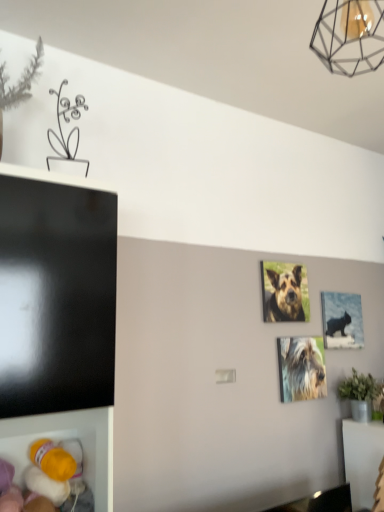
In order to face metallic wireframe lamp at upper right, should I rotate leftwards or rightwards?

Rotate right and turn 20.564 degrees.

Measure the distance between metallic wireframe lamp at upper right and camera.

A distance of 35.16 inches exists between metallic wireframe lamp at upper right and camera.

I want to click on shaggy fur dog at center, the second dog in the top-to-bottom sequence, so click(x=302, y=368).

Based on their positions, is metallic silver picture frame at center-right located to the left or right of brown fur dog at center, positioned as the first dog in top-to-bottom order?

In the image, metallic silver picture frame at center-right appears on the right side of brown fur dog at center, positioned as the first dog in top-to-bottom order.

Where is `picture frame lying below the brown fur dog at center, positioned as the first dog in top-to-bottom order (from the image's perspective)`? This screenshot has height=512, width=384. picture frame lying below the brown fur dog at center, positioned as the first dog in top-to-bottom order (from the image's perspective) is located at coordinates (x=342, y=320).

Considering the points (343, 323) and (287, 311), which point is in front, point (343, 323) or point (287, 311)?

Positioned in front is point (287, 311).

From a real-world perspective, is metallic silver picture frame at center-right under brown fur dog at center, marked as the 2th dog in a bottom-to-top arrangement?

Yes.

Can you confirm if metallic silver picture frame at center-right is taller than shaggy fur dog at center, the second dog in the top-to-bottom sequence?

Indeed, metallic silver picture frame at center-right has a greater height compared to shaggy fur dog at center, the second dog in the top-to-bottom sequence.

Identify the location of dog below the metallic silver picture frame at center-right (from the image's perspective). The image size is (384, 512). (302, 368).

Does metallic silver picture frame at center-right have a larger size compared to shaggy fur dog at center, the second dog in the top-to-bottom sequence?

Indeed, metallic silver picture frame at center-right has a larger size compared to shaggy fur dog at center, the second dog in the top-to-bottom sequence.

How many degrees apart are the facing directions of metallic silver picture frame at center-right and shaggy fur dog at center, the second dog in the top-to-bottom sequence?

metallic silver picture frame at center-right and shaggy fur dog at center, the second dog in the top-to-bottom sequence, are facing 0.00156 degrees away from each other.

Is point (328, 42) closer or farther from the camera than point (342, 320)?

Point (328, 42).

Between metallic wireframe lamp at upper right and metallic silver picture frame at center-right, which one has smaller size?

metallic silver picture frame at center-right.

Does metallic wireframe lamp at upper right come behind metallic silver picture frame at center-right?

No, metallic wireframe lamp at upper right is in front of metallic silver picture frame at center-right.

Are metallic wireframe lamp at upper right and metallic silver picture frame at center-right beside each other?

metallic wireframe lamp at upper right and metallic silver picture frame at center-right are not in contact.

Where is `lamp located above the brown fur dog at center, marked as the 2th dog in a bottom-to-top arrangement (from the image's perspective)`? lamp located above the brown fur dog at center, marked as the 2th dog in a bottom-to-top arrangement (from the image's perspective) is located at coordinates (350, 36).

Looking at this image, does brown fur dog at center, marked as the 2th dog in a bottom-to-top arrangement, turn towards metallic wireframe lamp at upper right?

No, brown fur dog at center, marked as the 2th dog in a bottom-to-top arrangement, is not aimed at metallic wireframe lamp at upper right.

In terms of width, does brown fur dog at center, positioned as the first dog in top-to-bottom order, look wider or thinner when compared to metallic wireframe lamp at upper right?

Clearly, brown fur dog at center, positioned as the first dog in top-to-bottom order, has less width compared to metallic wireframe lamp at upper right.

Is point (302, 317) behind point (320, 13)?

Yes.

Are shaggy fur dog at center, the second dog in the top-to-bottom sequence, and metallic silver picture frame at center-right far apart?

shaggy fur dog at center, the second dog in the top-to-bottom sequence, is actually quite close to metallic silver picture frame at center-right.

Between shaggy fur dog at center, the second dog in the top-to-bottom sequence, and metallic silver picture frame at center-right, which one has larger size?

With larger size is metallic silver picture frame at center-right.

Considering the relative sizes of shaggy fur dog at center, the second dog in the top-to-bottom sequence, and metallic silver picture frame at center-right in the image provided, is shaggy fur dog at center, the second dog in the top-to-bottom sequence, thinner than metallic silver picture frame at center-right?

Indeed, shaggy fur dog at center, the second dog in the top-to-bottom sequence, has a lesser width compared to metallic silver picture frame at center-right.

In terms of size, does metallic wireframe lamp at upper right appear bigger or smaller than brown fur dog at center, marked as the 2th dog in a bottom-to-top arrangement?

In the image, metallic wireframe lamp at upper right appears to be larger than brown fur dog at center, marked as the 2th dog in a bottom-to-top arrangement.

Is metallic wireframe lamp at upper right next to brown fur dog at center, positioned as the first dog in top-to-bottom order?

No, metallic wireframe lamp at upper right is not touching brown fur dog at center, positioned as the first dog in top-to-bottom order.

In the image, there is a brown fur dog at center, marked as the 2th dog in a bottom-to-top arrangement. At what (x,y) coordinates should I click in order to perform the action: click on lamp above it (from the image's perspective). Please return your answer as a coordinate pair (x, y). The height and width of the screenshot is (512, 384). Looking at the image, I should click on (350, 36).

Image resolution: width=384 pixels, height=512 pixels. What are the coordinates of `picture frame on the right side of metallic wireframe lamp at upper right` in the screenshot? It's located at pos(342,320).

Considering the relative positions of metallic silver picture frame at center-right and metallic wireframe lamp at upper right in the image provided, is metallic silver picture frame at center-right behind metallic wireframe lamp at upper right?

That is True.

From a real-world perspective, is metallic silver picture frame at center-right positioned above or below metallic wireframe lamp at upper right?

From a real-world perspective, metallic silver picture frame at center-right is physically below metallic wireframe lamp at upper right.

This screenshot has width=384, height=512. I want to click on dog above the metallic silver picture frame at center-right (from the image's perspective), so click(285, 296).

The width and height of the screenshot is (384, 512). Identify the location of picture frame on the right of the shaggy fur dog at center, the second dog in the top-to-bottom sequence. (342, 320).

Considering their positions, is shaggy fur dog at center, the second dog in the top-to-bottom sequence, positioned closer to metallic wireframe lamp at upper right than brown fur dog at center, positioned as the first dog in top-to-bottom order?

Based on the image, brown fur dog at center, positioned as the first dog in top-to-bottom order, appears to be nearer to metallic wireframe lamp at upper right.

Looking at the image, which one is located closer to brown fur dog at center, marked as the 2th dog in a bottom-to-top arrangement, metallic silver picture frame at center-right or shaggy fur dog at center, the second dog in the top-to-bottom sequence?

The object closer to brown fur dog at center, marked as the 2th dog in a bottom-to-top arrangement, is shaggy fur dog at center, the second dog in the top-to-bottom sequence.

Looking at the image, which one is located closer to shaggy fur dog at center, the 1th dog positioned from the bottom, brown fur dog at center, marked as the 2th dog in a bottom-to-top arrangement, or metallic silver picture frame at center-right?

The object closer to shaggy fur dog at center, the 1th dog positioned from the bottom, is brown fur dog at center, marked as the 2th dog in a bottom-to-top arrangement.

When comparing their distances from brown fur dog at center, marked as the 2th dog in a bottom-to-top arrangement, does metallic silver picture frame at center-right or metallic wireframe lamp at upper right seem further?

metallic wireframe lamp at upper right lies further to brown fur dog at center, marked as the 2th dog in a bottom-to-top arrangement, than the other object.

From the image, which object appears to be nearer to shaggy fur dog at center, the 1th dog positioned from the bottom, brown fur dog at center, positioned as the first dog in top-to-bottom order, or metallic wireframe lamp at upper right?

Among the two, brown fur dog at center, positioned as the first dog in top-to-bottom order, is located nearer to shaggy fur dog at center, the 1th dog positioned from the bottom.

Which object lies further to the anchor point shaggy fur dog at center, the 1th dog positioned from the bottom, metallic wireframe lamp at upper right or metallic silver picture frame at center-right?

Based on the image, metallic wireframe lamp at upper right appears to be further to shaggy fur dog at center, the 1th dog positioned from the bottom.

When comparing their distances from metallic wireframe lamp at upper right, does shaggy fur dog at center, the 1th dog positioned from the bottom, or metallic silver picture frame at center-right seem further?

Among the two, shaggy fur dog at center, the 1th dog positioned from the bottom, is located further to metallic wireframe lamp at upper right.

From the image, which object appears to be farther from metallic silver picture frame at center-right, shaggy fur dog at center, the 1th dog positioned from the bottom, or brown fur dog at center, positioned as the first dog in top-to-bottom order?

Among the two, brown fur dog at center, positioned as the first dog in top-to-bottom order, is located further to metallic silver picture frame at center-right.

Where is `dog between metallic wireframe lamp at upper right and brown fur dog at center, marked as the 2th dog in a bottom-to-top arrangement, along the z-axis`? dog between metallic wireframe lamp at upper right and brown fur dog at center, marked as the 2th dog in a bottom-to-top arrangement, along the z-axis is located at coordinates click(302, 368).

You are a GUI agent. You are given a task and a screenshot of the screen. Output one action in this format:
    pyautogui.click(x=<x>, y=<y>)
    Task: Click on the picture frame between brown fur dog at center, marked as the 2th dog in a bottom-to-top arrangement, and shaggy fur dog at center, the 1th dog positioned from the bottom, in the up-down direction
    This screenshot has height=512, width=384.
    Given the screenshot: What is the action you would take?
    [342, 320]